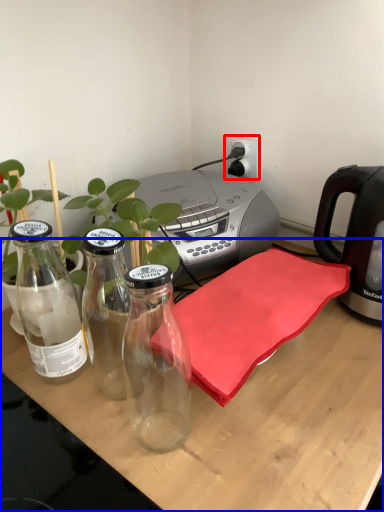
Question: Which point is further to the camera, electric outlet (highlighted by a red box) or desk (highlighted by a blue box)?

Choices:
 (A) electric outlet
 (B) desk

Answer: (A)